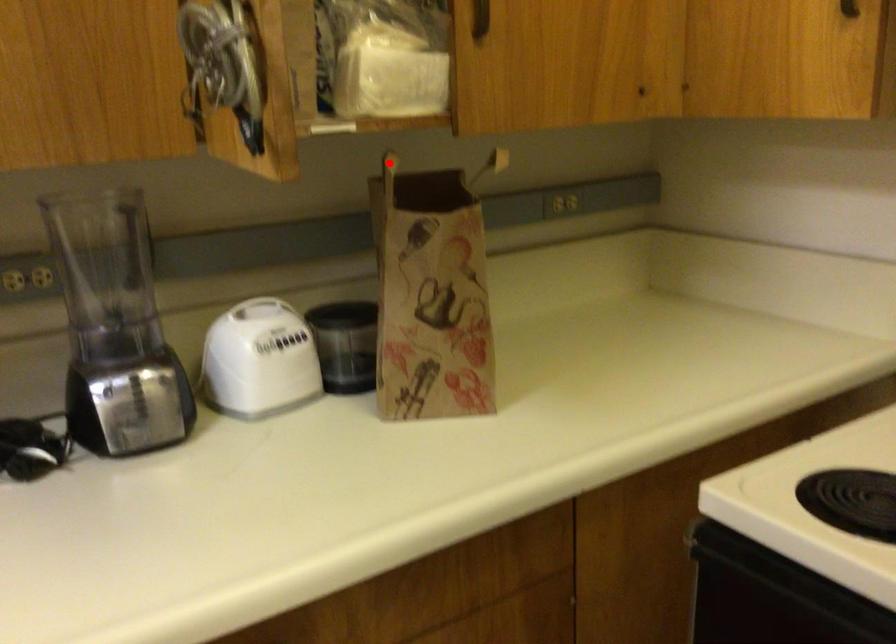
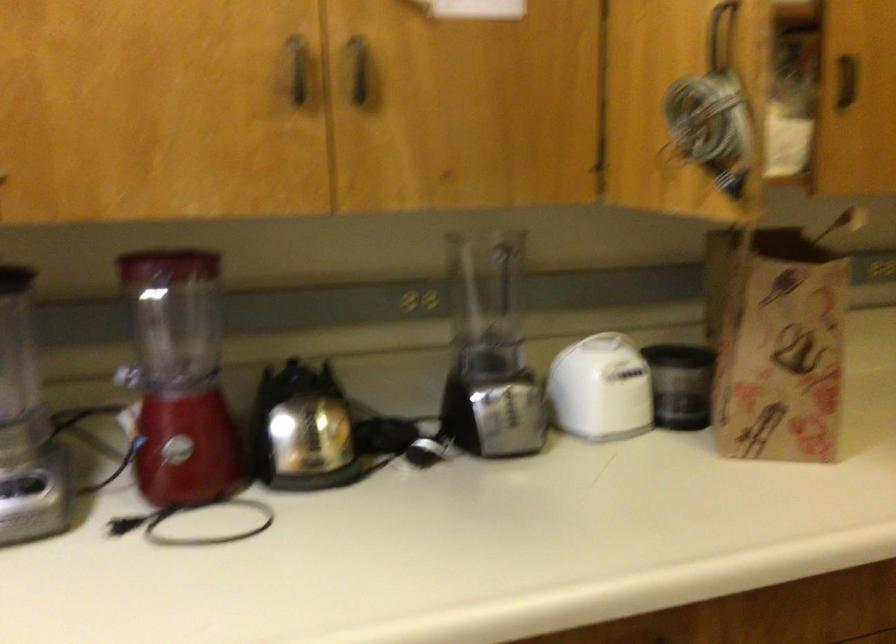
Question: A red point is marked in image1. In image2, is the corresponding 3D point closer to the camera or farther? Reply with the corresponding letter.

Choices:
 (A) The corresponding 3D point is closer.
 (B) The corresponding 3D point is farther.

Answer: (A)